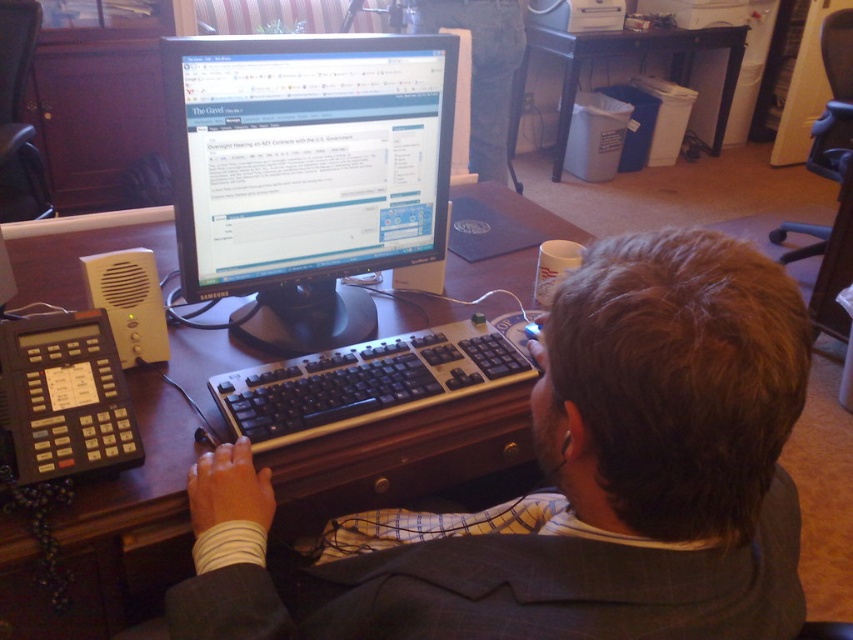
You are organizing the desk and need to place a new item between the wooden at center and the white plastic trash can at lower right. Based on their positions, where should you place the new item?

You should place the new item to the right of the wooden at center and to the left of the white plastic trash can at lower right since the wooden at center is positioned to the left of the white plastic trash can at lower right.

Where is the wooden at center located in 2D coordinates?

The wooden at center is located at the 2D coordinates point (111, 532).

You are taking a photo of the desk setup. You want to focus on the two points marked as point 1 at point (407, 340) and point 2 at point (569, 54). Which point should you focus on first to ensure both points are in sharp focus?

You should focus on point 1 at point (407, 340) first because it is closer to the camera than point 2 at point (569, 54). This way, the focus will extend to the farther point as well.